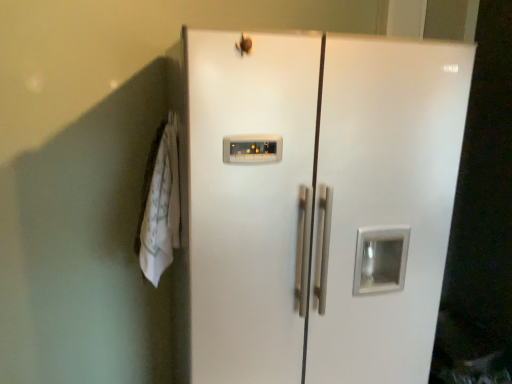
Question: Is white fabric towel at left oriented towards white glossy refrigerator at center?

Choices:
 (A) no
 (B) yes

Answer: (A)

Question: From the image's perspective, is white fabric towel at left beneath white glossy refrigerator at center?

Choices:
 (A) no
 (B) yes

Answer: (A)

Question: Does white fabric towel at left appear on the left side of white glossy refrigerator at center?

Choices:
 (A) no
 (B) yes

Answer: (B)

Question: Does white fabric towel at left have a greater width compared to white glossy refrigerator at center?

Choices:
 (A) yes
 (B) no

Answer: (B)

Question: From a real-world perspective, is white fabric towel at left under white glossy refrigerator at center?

Choices:
 (A) yes
 (B) no

Answer: (B)

Question: Can you confirm if white fabric towel at left is shorter than white glossy refrigerator at center?

Choices:
 (A) yes
 (B) no

Answer: (A)

Question: Is white glossy refrigerator at center positioned beyond the bounds of white fabric towel at left?

Choices:
 (A) yes
 (B) no

Answer: (A)

Question: Is white fabric towel at left a part of white glossy refrigerator at center?

Choices:
 (A) yes
 (B) no

Answer: (B)

Question: Is white glossy refrigerator at center facing towards white fabric towel at left?

Choices:
 (A) no
 (B) yes

Answer: (A)

Question: Considering the relative sizes of white glossy refrigerator at center and white fabric towel at left in the image provided, is white glossy refrigerator at center smaller than white fabric towel at left?

Choices:
 (A) no
 (B) yes

Answer: (A)

Question: From the image's perspective, is white glossy refrigerator at center on top of white fabric towel at left?

Choices:
 (A) yes
 (B) no

Answer: (B)

Question: Is white glossy refrigerator at center taller than white fabric towel at left?

Choices:
 (A) yes
 (B) no

Answer: (A)

Question: Which is correct: white fabric towel at left is inside white glossy refrigerator at center, or outside of it?

Choices:
 (A) inside
 (B) outside

Answer: (B)